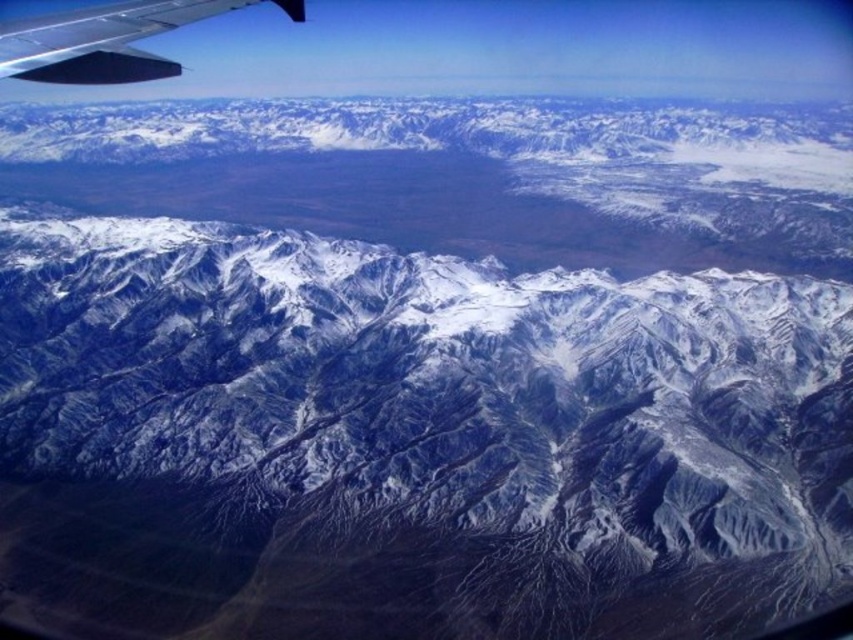
Can you confirm if snowy rocky mountain range at center is bigger than matte black wing at upper left?

Yes, snowy rocky mountain range at center is bigger than matte black wing at upper left.

Is snowy rocky mountain range at center to the left of matte black wing at upper left from the viewer's perspective?

No, snowy rocky mountain range at center is not to the left of matte black wing at upper left.

Locate an element on the screen. The image size is (853, 640). snowy rocky mountain range at center is located at coordinates (468, 173).